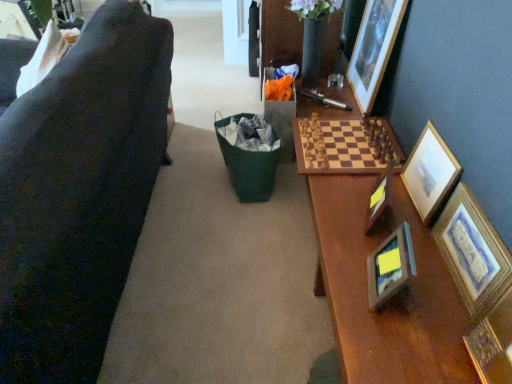
Question: Should I look upward or downward to see wooden picture frame at right, the 4th picture frame viewed from the right?

Choices:
 (A) down
 (B) up

Answer: (A)

Question: Is wooden framed print at right, which appears as the 1th picture frame when viewed from the right, positioned with its back to wooden picture frame at right, acting as the 3th picture frame starting from the left?

Choices:
 (A) no
 (B) yes

Answer: (A)

Question: Are wooden framed print at right, which appears as the 1th picture frame when viewed from the right, and wooden picture frame at right, the 4th picture frame viewed from the right, located far from each other?

Choices:
 (A) yes
 (B) no

Answer: (B)

Question: Is wooden framed print at right, the sixth picture frame from the left, to the right of wooden picture frame at right, the 4th picture frame viewed from the right, from the viewer's perspective?

Choices:
 (A) yes
 (B) no

Answer: (A)

Question: Does wooden framed print at right, the sixth picture frame from the left, turn towards wooden picture frame at right, acting as the 3th picture frame starting from the left?

Choices:
 (A) yes
 (B) no

Answer: (B)

Question: Does wooden framed print at right, which appears as the 1th picture frame when viewed from the right, have a lesser width compared to wooden picture frame at right, acting as the 3th picture frame starting from the left?

Choices:
 (A) yes
 (B) no

Answer: (A)

Question: Can you confirm if wooden framed print at right, which appears as the 1th picture frame when viewed from the right, is taller than wooden picture frame at right, the 4th picture frame viewed from the right?

Choices:
 (A) no
 (B) yes

Answer: (B)

Question: Can you confirm if wooden framed print at right, which appears as the 1th picture frame when viewed from the right, is bigger than gold-framed picture at right, the 2th picture frame viewed from the right?

Choices:
 (A) yes
 (B) no

Answer: (B)

Question: Is the depth of wooden framed print at right, which appears as the 1th picture frame when viewed from the right, less than that of gold-framed picture at right, the 5th picture frame viewed from the left?

Choices:
 (A) no
 (B) yes

Answer: (B)

Question: Is wooden framed print at right, which appears as the 1th picture frame when viewed from the right, shorter than gold-framed picture at right, the 2th picture frame viewed from the right?

Choices:
 (A) yes
 (B) no

Answer: (A)

Question: Would you say wooden framed print at right, which appears as the 1th picture frame when viewed from the right, contains gold-framed picture at right, the 5th picture frame viewed from the left?

Choices:
 (A) yes
 (B) no

Answer: (B)

Question: Is wooden framed print at right, which appears as the 1th picture frame when viewed from the right, to the left of gold-framed picture at right, the 5th picture frame viewed from the left, from the viewer's perspective?

Choices:
 (A) no
 (B) yes

Answer: (A)

Question: Is wooden framed print at right, which appears as the 1th picture frame when viewed from the right, positioned far away from gold-framed picture at right, the 5th picture frame viewed from the left?

Choices:
 (A) no
 (B) yes

Answer: (A)

Question: Does wooden picture frame at upper right, which ranks as the third picture frame in right-to-left order, appear on the right side of wooden framed print at right, the sixth picture frame from the left?

Choices:
 (A) no
 (B) yes

Answer: (A)